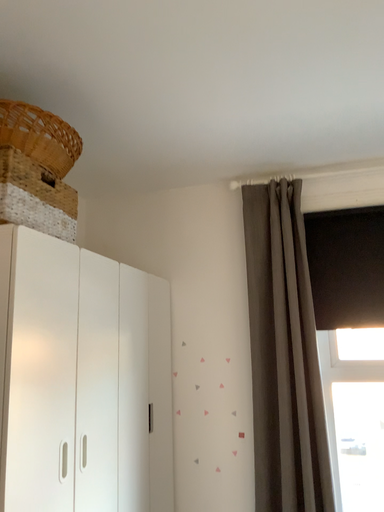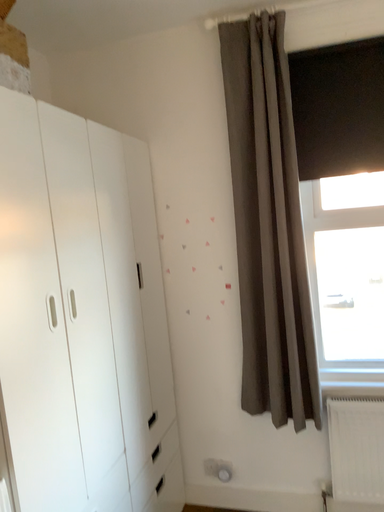
Question: Which way did the camera rotate in the video?

Choices:
 (A) rotated downward
 (B) rotated upward

Answer: (A)